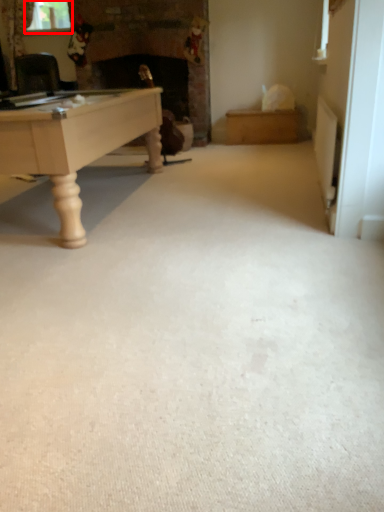
Question: From the image's perspective, what is the correct spatial positioning of window screen (annotated by the red box) in reference to plain?

Choices:
 (A) above
 (B) below

Answer: (A)